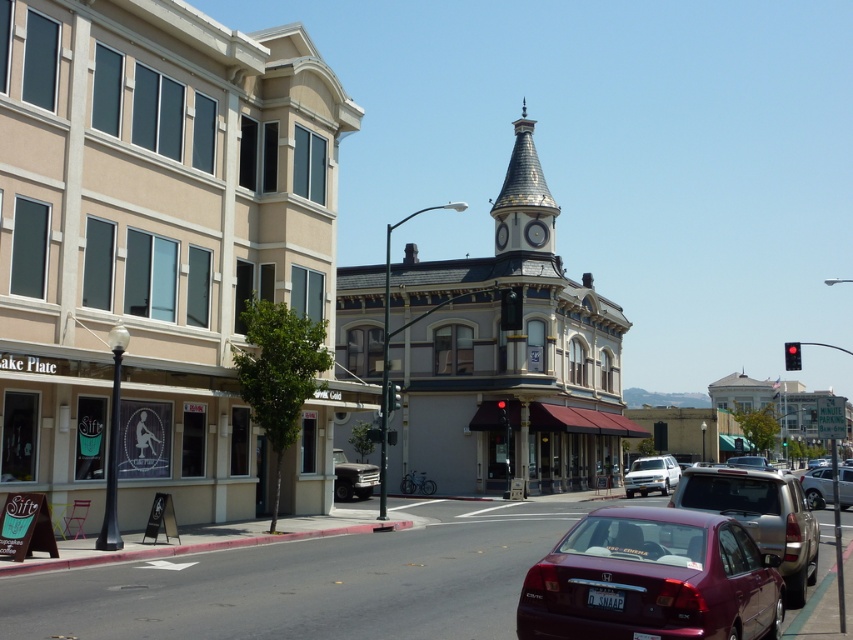
Question: Is maroon metallic sedan at center above metallic silver car at center?

Choices:
 (A) yes
 (B) no

Answer: (A)

Question: From the image, what is the correct spatial relationship of maroon metallic sedan at lower right in relation to silver metallic truck at center-right?

Choices:
 (A) above
 (B) below

Answer: (A)

Question: Based on their relative distances, which object is farther from the maroon metallic sedan at center?

Choices:
 (A) satin silver sedan at center
 (B) black plastic traffic light at center

Answer: (B)

Question: Which point is closer to the camera?

Choices:
 (A) green glass traffic light at center
 (B) silver metallic truck at center-right
 (C) red glass traffic light at center

Answer: (A)

Question: Which is farther from the gold textured clock tower at upper center?

Choices:
 (A) green glass traffic light at center
 (B) maroon metallic sedan at lower right

Answer: (B)

Question: Is gold textured clock tower at upper center below green glass traffic light at center?

Choices:
 (A) no
 (B) yes

Answer: (A)